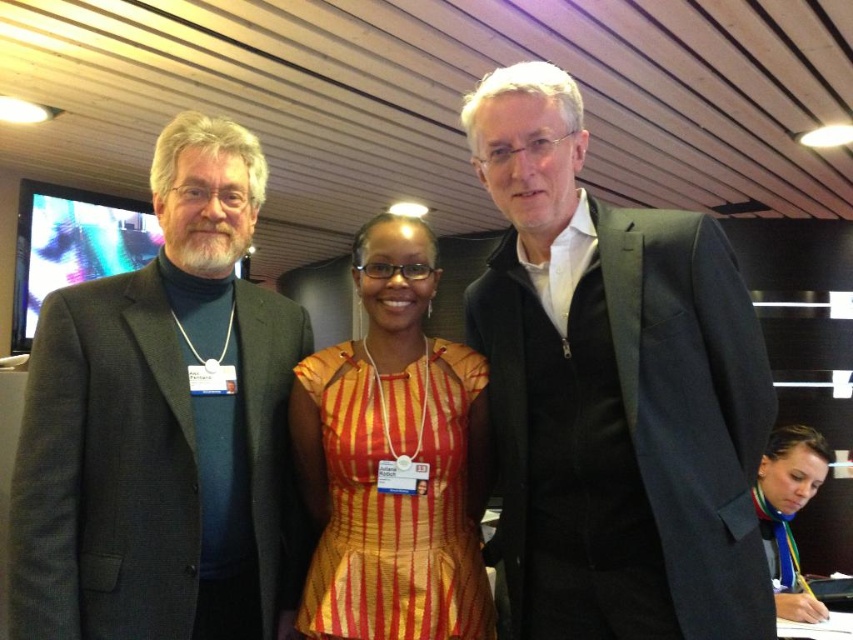
Question: Which object is farther from the camera taking this photo?

Choices:
 (A) dark gray suit at left
 (B) orange striped dress at center

Answer: (B)

Question: Can you confirm if orange striped dress at center is positioned to the right of matte black jacket at lower right?

Choices:
 (A) no
 (B) yes

Answer: (A)

Question: Is matte black suit at center to the right of dark gray suit at left from the viewer's perspective?

Choices:
 (A) no
 (B) yes

Answer: (B)

Question: Does orange striped dress at center appear on the left side of matte black jacket at lower right?

Choices:
 (A) yes
 (B) no

Answer: (A)

Question: Estimate the real-world distances between objects in this image. Which object is closer to the dark gray suit at left?

Choices:
 (A) orange striped dress at center
 (B) matte black jacket at lower right
 (C) matte black suit at center

Answer: (A)

Question: Which object is the closest to the dark gray suit at left?

Choices:
 (A) matte black suit at center
 (B) matte black jacket at lower right
 (C) orange striped dress at center

Answer: (C)